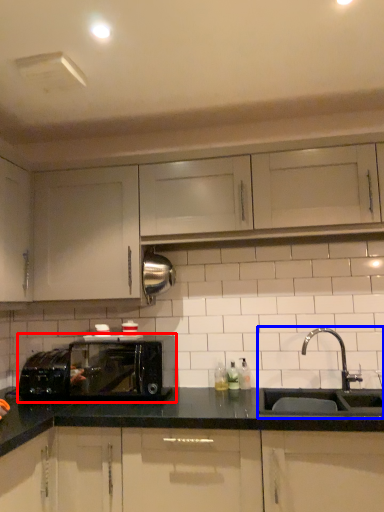
Question: Which object appears farthest to the camera in this image, microwave oven (highlighted by a red box) or sink (highlighted by a blue box)?

Choices:
 (A) microwave oven
 (B) sink

Answer: (A)